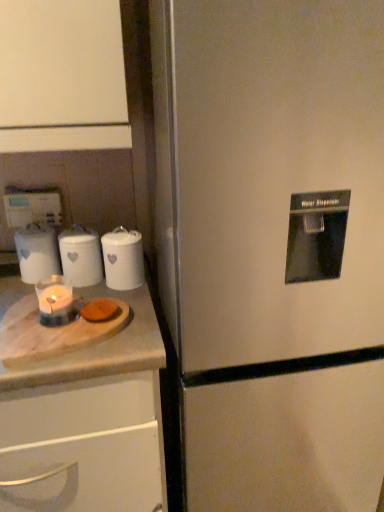
The height and width of the screenshot is (512, 384). In order to click on vacant area located to the right-hand side of brown matte cookie at lower left in this screenshot , I will do [x=137, y=323].